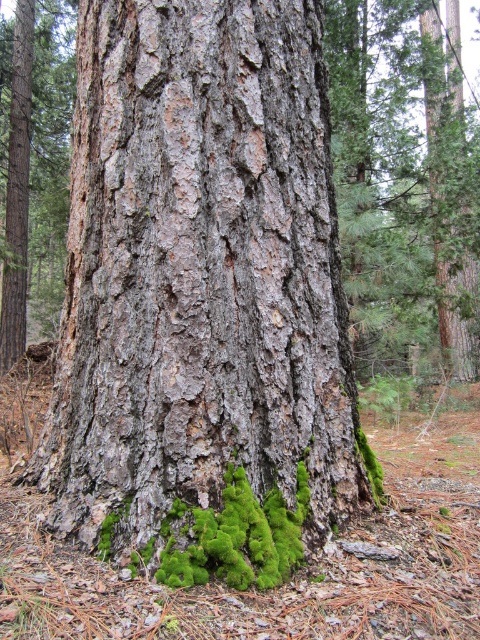
Question: Among these points, which one is farthest from the camera?

Choices:
 (A) (427, 204)
 (B) (228, 160)
 (C) (282, 529)

Answer: (A)

Question: Which object is the farthest from the green fuzzy moss at lower center?

Choices:
 (A) gray rough bark tree trunk at center
 (B) smooth bark tree at center

Answer: (B)

Question: Which object is the farthest from the gray rough bark tree trunk at center?

Choices:
 (A) green fuzzy moss at lower center
 (B) smooth bark tree at center

Answer: (B)

Question: Can you confirm if smooth bark tree at center is positioned to the left of green fuzzy moss at lower center?

Choices:
 (A) yes
 (B) no

Answer: (B)

Question: Does smooth bark tree at center have a smaller size compared to green fuzzy moss at lower center?

Choices:
 (A) no
 (B) yes

Answer: (A)

Question: Is smooth bark tree at center below green fuzzy moss at lower center?

Choices:
 (A) no
 (B) yes

Answer: (A)